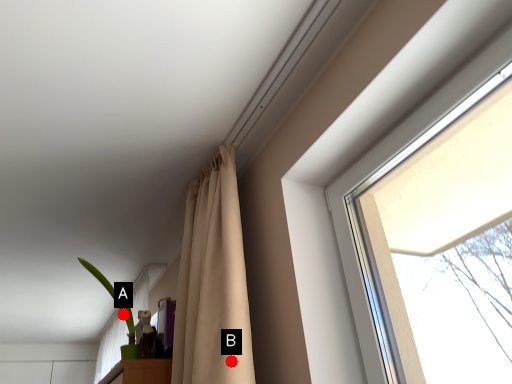
Question: Two points are circled on the image, labeled by A and B beside each circle. Which point appears farthest from the camera in this image?

Choices:
 (A) A is further
 (B) B is further

Answer: (A)